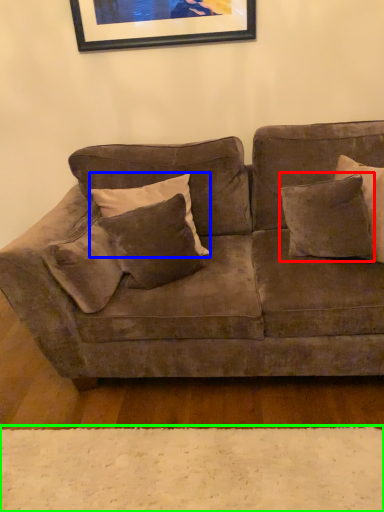
Question: Which is nearer to the pillow (highlighted by a red box)? pillow (highlighted by a blue box) or plain (highlighted by a green box).

Choices:
 (A) pillow
 (B) plain

Answer: (A)